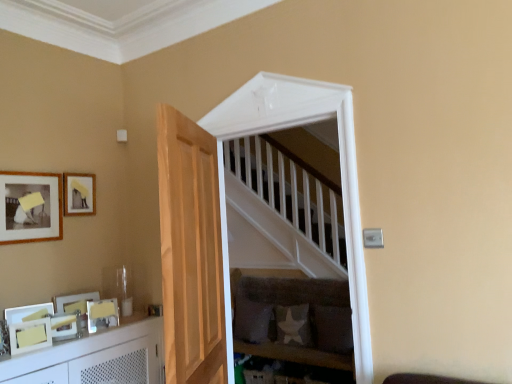
Question: Is matte yellow picture frame at upper left, positioned as the 5th picture frame in bottom-to-top order, taller than light brown wooden door at center?

Choices:
 (A) yes
 (B) no

Answer: (B)

Question: Is matte yellow picture frame at upper left, which is counted as the first picture frame, starting from the top, positioned before light brown wooden door at center?

Choices:
 (A) yes
 (B) no

Answer: (B)

Question: Considering the relative sizes of matte yellow picture frame at upper left, which is counted as the first picture frame, starting from the top, and light brown wooden door at center in the image provided, is matte yellow picture frame at upper left, which is counted as the first picture frame, starting from the top, thinner than light brown wooden door at center?

Choices:
 (A) no
 (B) yes

Answer: (B)

Question: Is matte yellow picture frame at upper left, which is counted as the first picture frame, starting from the top, at the right side of light brown wooden door at center?

Choices:
 (A) yes
 (B) no

Answer: (B)

Question: Is light brown wooden door at center at the back of matte yellow picture frame at upper left, which is counted as the first picture frame, starting from the top?

Choices:
 (A) yes
 (B) no

Answer: (B)

Question: In the image, is velvet grey sofa at center on the left side or the right side of matte white picture frame at lower left, arranged as the 3th picture frame when ordered from the bottom?

Choices:
 (A) left
 (B) right

Answer: (B)

Question: Relative to matte white picture frame at lower left, the 3th picture frame from the top, is velvet grey sofa at center in front or behind?

Choices:
 (A) front
 (B) behind

Answer: (B)

Question: Is velvet grey sofa at center spatially inside matte white picture frame at lower left, arranged as the 3th picture frame when ordered from the bottom, or outside of it?

Choices:
 (A) outside
 (B) inside

Answer: (A)

Question: Looking at their shapes, would you say velvet grey sofa at center is wider or thinner than matte white picture frame at lower left, the 3th picture frame from the top?

Choices:
 (A) thin
 (B) wide

Answer: (B)

Question: From the image's perspective, is matte yellow picture frame at upper left, which is counted as the first picture frame, starting from the top, above or below white glossy cabinet at lower left?

Choices:
 (A) above
 (B) below

Answer: (A)

Question: Looking at their shapes, would you say matte yellow picture frame at upper left, which is counted as the first picture frame, starting from the top, is wider or thinner than white glossy cabinet at lower left?

Choices:
 (A) thin
 (B) wide

Answer: (A)

Question: From a real-world perspective, is matte yellow picture frame at upper left, positioned as the 5th picture frame in bottom-to-top order, above or below white glossy cabinet at lower left?

Choices:
 (A) above
 (B) below

Answer: (A)

Question: Considering the positions of matte yellow picture frame at upper left, positioned as the 5th picture frame in bottom-to-top order, and white glossy cabinet at lower left in the image, is matte yellow picture frame at upper left, positioned as the 5th picture frame in bottom-to-top order, taller or shorter than white glossy cabinet at lower left?

Choices:
 (A) tall
 (B) short

Answer: (B)

Question: Considering their positions, is white fabric pillow at lower center, placed as the first pillow when sorted from left to right, located in front of or behind matte gold picture frame at lower left, which is the 2th picture frame in bottom-to-top order?

Choices:
 (A) behind
 (B) front

Answer: (A)

Question: Is white fabric pillow at lower center, the 3th pillow viewed from the right, bigger or smaller than matte gold picture frame at lower left, which is counted as the fourth picture frame, starting from the top?

Choices:
 (A) small
 (B) big

Answer: (B)